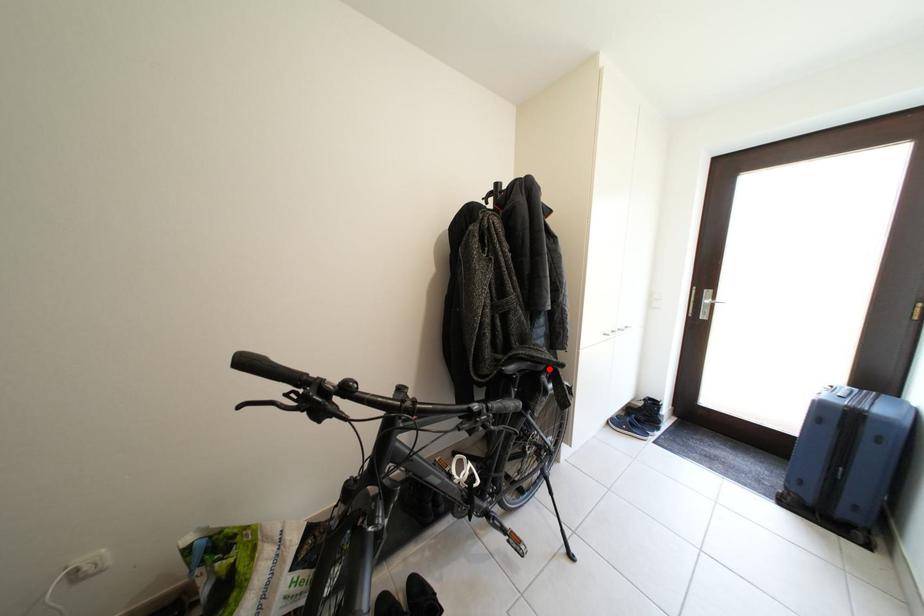
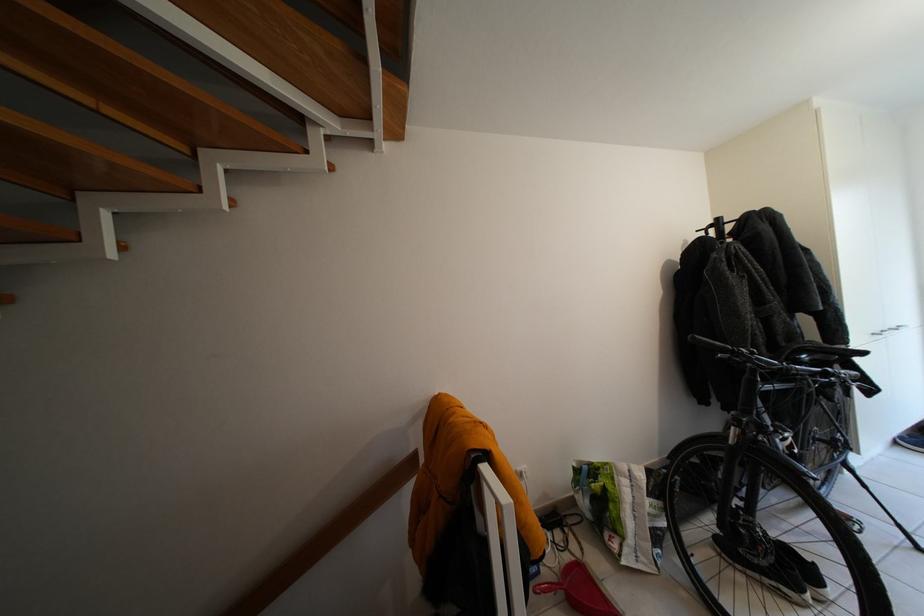
In the second image, find the point that corresponds to the highlighted location in the first image.

(841, 360)